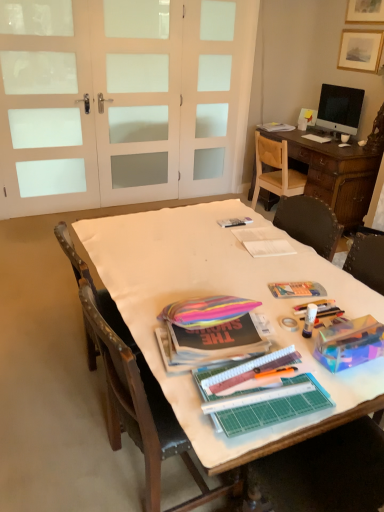
What are the coordinates of `vacant space positioned to the left of rainbow fabric bag at center, which is counted as the third magazine, starting from the back` in the screenshot? It's located at (144, 302).